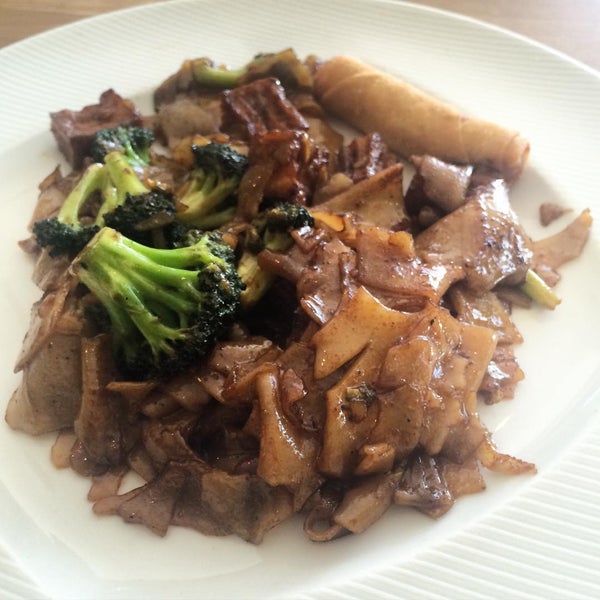
This screenshot has width=600, height=600. I want to click on something white underneath plate, so click(x=461, y=571), click(x=18, y=592).